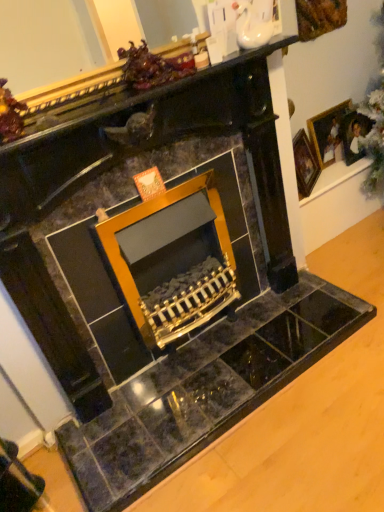
Describe the element at coordinates (305, 164) in the screenshot. This screenshot has height=512, width=384. I see `gold-framed picture at upper right, which is the first picture frame from left to right` at that location.

Identify the location of gold-framed picture at upper right, acting as the second picture frame starting from the right. (305, 164).

Describe the element at coordinates (337, 132) in the screenshot. The width and height of the screenshot is (384, 512). I see `wooden picture frame at upper right, which is the 1th picture frame from right to left` at that location.

This screenshot has width=384, height=512. I want to click on wooden picture frame at upper right, which is the 1th picture frame from right to left, so tap(337, 132).

Image resolution: width=384 pixels, height=512 pixels. Identify the location of gold-framed picture at upper right, which is the first picture frame from left to right. (305, 164).

Based on the photo, can you confirm if wooden picture frame at upper right, which is the 1th picture frame from right to left, is positioned to the left of gold-framed picture at upper right, which is the first picture frame from left to right?

Incorrect, wooden picture frame at upper right, which is the 1th picture frame from right to left, is not on the left side of gold-framed picture at upper right, which is the first picture frame from left to right.

Is wooden picture frame at upper right, which appears as the 2th picture frame when viewed from the left, closer to the viewer compared to gold-framed picture at upper right, acting as the second picture frame starting from the right?

No, wooden picture frame at upper right, which appears as the 2th picture frame when viewed from the left, is further to the viewer.

Considering the positions of point (327, 122) and point (298, 147), is point (327, 122) closer or farther from the camera than point (298, 147)?

Point (327, 122) is positioned farther from the camera compared to point (298, 147).

From the image's perspective, between wooden picture frame at upper right, which appears as the 2th picture frame when viewed from the left, and gold-framed picture at upper right, which is the first picture frame from left to right, which one is located above?

From the image's view, wooden picture frame at upper right, which appears as the 2th picture frame when viewed from the left, is above.

From a real-world perspective, which object rests below the other?

In real-world perspective, gold-framed picture at upper right, acting as the second picture frame starting from the right, is lower.

Looking at their sizes, would you say wooden picture frame at upper right, which appears as the 2th picture frame when viewed from the left, is wider or thinner than gold-framed picture at upper right, which is the first picture frame from left to right?

In the image, wooden picture frame at upper right, which appears as the 2th picture frame when viewed from the left, appears to be more narrow than gold-framed picture at upper right, which is the first picture frame from left to right.

From their relative heights in the image, would you say wooden picture frame at upper right, which appears as the 2th picture frame when viewed from the left, is taller or shorter than gold-framed picture at upper right, which is the first picture frame from left to right?

Clearly, wooden picture frame at upper right, which appears as the 2th picture frame when viewed from the left, is shorter compared to gold-framed picture at upper right, which is the first picture frame from left to right.

Can you confirm if wooden picture frame at upper right, which is the 1th picture frame from right to left, is bigger than gold-framed picture at upper right, which is the first picture frame from left to right?

No, wooden picture frame at upper right, which is the 1th picture frame from right to left, is not bigger than gold-framed picture at upper right, which is the first picture frame from left to right.

Can we say wooden picture frame at upper right, which is the 1th picture frame from right to left, lies outside gold-framed picture at upper right, which is the first picture frame from left to right?

wooden picture frame at upper right, which is the 1th picture frame from right to left, is positioned outside gold-framed picture at upper right, which is the first picture frame from left to right.

Are wooden picture frame at upper right, which is the 1th picture frame from right to left, and gold-framed picture at upper right, acting as the second picture frame starting from the right, making contact?

They are not placed beside each other.

Is wooden picture frame at upper right, which is the 1th picture frame from right to left, aimed at gold-framed picture at upper right, acting as the second picture frame starting from the right?

No.

Locate an element on the screen. This screenshot has width=384, height=512. picture frame in front of the wooden picture frame at upper right, which appears as the 2th picture frame when viewed from the left is located at coordinates (305, 164).

Between gold-framed picture at upper right, acting as the second picture frame starting from the right, and wooden picture frame at upper right, which appears as the 2th picture frame when viewed from the left, which one appears on the right side from the viewer's perspective?

From the viewer's perspective, wooden picture frame at upper right, which appears as the 2th picture frame when viewed from the left, appears more on the right side.

Looking at this image, considering the relative positions of gold-framed picture at upper right, which is the first picture frame from left to right, and wooden picture frame at upper right, which is the 1th picture frame from right to left, in the image provided, is gold-framed picture at upper right, which is the first picture frame from left to right, behind wooden picture frame at upper right, which is the 1th picture frame from right to left,?

No, it is not.

Between point (312, 182) and point (321, 154), which one is positioned in front?

The point (312, 182) is closer to the camera.

From the image's perspective, is gold-framed picture at upper right, which is the first picture frame from left to right, over wooden picture frame at upper right, which appears as the 2th picture frame when viewed from the left?

No, from the image's perspective, gold-framed picture at upper right, which is the first picture frame from left to right, is not above wooden picture frame at upper right, which appears as the 2th picture frame when viewed from the left.

From a real-world perspective, is gold-framed picture at upper right, acting as the second picture frame starting from the right, above or below wooden picture frame at upper right, which is the 1th picture frame from right to left?

gold-framed picture at upper right, acting as the second picture frame starting from the right, is situated lower than wooden picture frame at upper right, which is the 1th picture frame from right to left, in the real world.

Considering the relative sizes of gold-framed picture at upper right, acting as the second picture frame starting from the right, and wooden picture frame at upper right, which is the 1th picture frame from right to left, in the image provided, is gold-framed picture at upper right, acting as the second picture frame starting from the right, thinner than wooden picture frame at upper right, which is the 1th picture frame from right to left,?

In fact, gold-framed picture at upper right, acting as the second picture frame starting from the right, might be wider than wooden picture frame at upper right, which is the 1th picture frame from right to left.

Can you confirm if gold-framed picture at upper right, which is the first picture frame from left to right, is taller than wooden picture frame at upper right, which appears as the 2th picture frame when viewed from the left?

Yes.

Looking at the image, does gold-framed picture at upper right, acting as the second picture frame starting from the right, seem bigger or smaller compared to wooden picture frame at upper right, which appears as the 2th picture frame when viewed from the left?

In the image, gold-framed picture at upper right, acting as the second picture frame starting from the right, appears to be larger than wooden picture frame at upper right, which appears as the 2th picture frame when viewed from the left.

Is gold-framed picture at upper right, which is the first picture frame from left to right, inside or outside of wooden picture frame at upper right, which is the 1th picture frame from right to left?

gold-framed picture at upper right, which is the first picture frame from left to right, is outside wooden picture frame at upper right, which is the 1th picture frame from right to left.

Is gold-framed picture at upper right, acting as the second picture frame starting from the right, next to wooden picture frame at upper right, which appears as the 2th picture frame when viewed from the left, and touching it?

No, gold-framed picture at upper right, acting as the second picture frame starting from the right, is not touching wooden picture frame at upper right, which appears as the 2th picture frame when viewed from the left.

Could you tell me if gold-framed picture at upper right, acting as the second picture frame starting from the right, is turned towards wooden picture frame at upper right, which appears as the 2th picture frame when viewed from the left?

No, gold-framed picture at upper right, acting as the second picture frame starting from the right, does not turn towards wooden picture frame at upper right, which appears as the 2th picture frame when viewed from the left.

How different are the orientations of gold-framed picture at upper right, acting as the second picture frame starting from the right, and wooden picture frame at upper right, which is the 1th picture frame from right to left, in degrees?

There is a 31.8-degree angle between the facing directions of gold-framed picture at upper right, acting as the second picture frame starting from the right, and wooden picture frame at upper right, which is the 1th picture frame from right to left.

Where is `picture frame on the right of gold-framed picture at upper right, acting as the second picture frame starting from the right`? picture frame on the right of gold-framed picture at upper right, acting as the second picture frame starting from the right is located at coordinates (337, 132).

Find the location of a particular element. This screenshot has height=512, width=384. picture frame above the gold-framed picture at upper right, which is the first picture frame from left to right (from a real-world perspective) is located at coordinates (337, 132).

This screenshot has width=384, height=512. What are the coordinates of `picture frame lying behind the gold-framed picture at upper right, acting as the second picture frame starting from the right` in the screenshot? It's located at (337, 132).